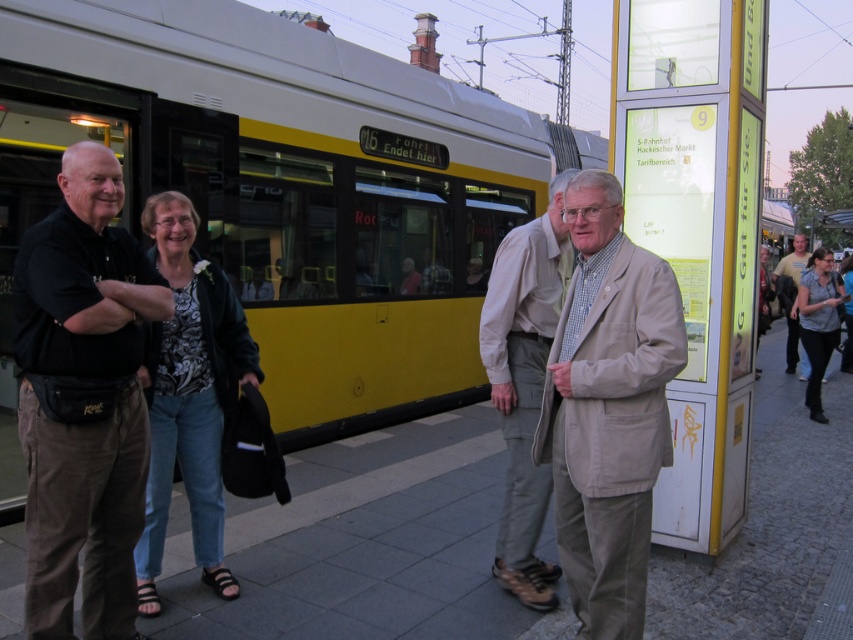
Does black cotton shirt at left have a smaller size compared to beige fabric coat at center?

No, black cotton shirt at left is not smaller than beige fabric coat at center.

Identify the location of black cotton shirt at left. This screenshot has height=640, width=853. (83, 401).

Where is `black cotton shirt at left`? black cotton shirt at left is located at coordinates (83, 401).

Which is more to the left, black cotton shirt at left or light beige jacket at center?

black cotton shirt at left

Locate an element on the screen. black cotton shirt at left is located at coordinates (83, 401).

The width and height of the screenshot is (853, 640). What are the coordinates of `black cotton shirt at left` in the screenshot? It's located at (83, 401).

Does black cotton shirt at left have a smaller size compared to light blue shirt at right?

Correct, black cotton shirt at left occupies less space than light blue shirt at right.

Image resolution: width=853 pixels, height=640 pixels. What do you see at coordinates (83, 401) in the screenshot?
I see `black cotton shirt at left` at bounding box center [83, 401].

What do you see at coordinates (83, 401) in the screenshot? I see `black cotton shirt at left` at bounding box center [83, 401].

Find the location of a particular element. The image size is (853, 640). black cotton shirt at left is located at coordinates (83, 401).